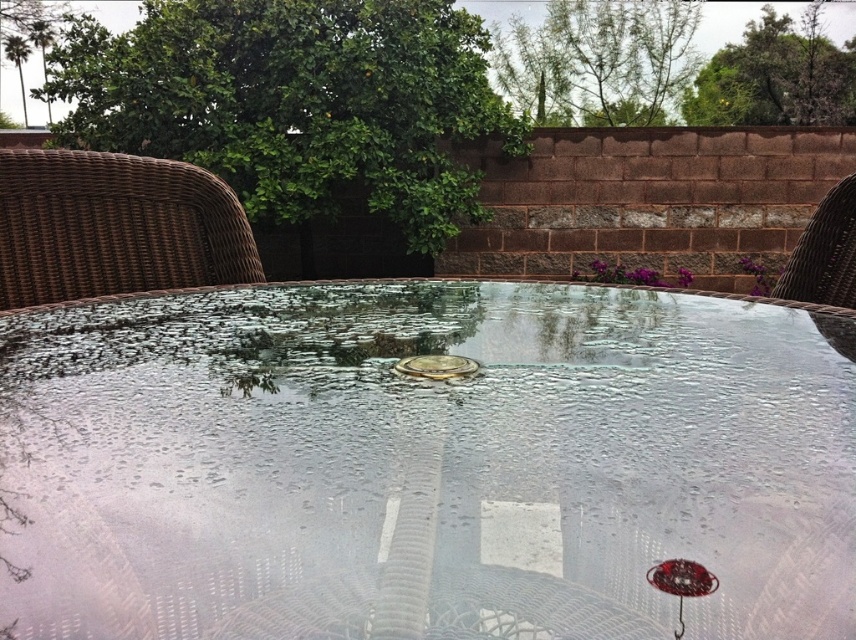
Is point (486, 566) farther from camera compared to point (434, 364)?

No, it is not.

Between transparent glass table at center and metallic gold coin at center, which one appears on the left side from the viewer's perspective?

From the viewer's perspective, transparent glass table at center appears more on the left side.

Is point (189, 333) positioned in front of point (455, 358)?

No, (189, 333) is behind (455, 358).

Identify the location of transparent glass table at center. This screenshot has width=856, height=640. [424, 465].

Who is shorter, transparent glass table at center or brown wicker chair at right?

With less height is transparent glass table at center.

Between transparent glass table at center and brown wicker chair at right, which one is positioned higher?

brown wicker chair at right is above.

Between point (227, 634) and point (813, 273), which one is positioned behind?

Positioned behind is point (813, 273).

Identify the location of transparent glass table at center. (424, 465).

From the picture: Which is below, brown wicker chair at left or metallic gold coin at center?

Positioned lower is metallic gold coin at center.

The height and width of the screenshot is (640, 856). Find the location of `brown wicker chair at left`. brown wicker chair at left is located at coordinates 114,227.

Between point (98, 214) and point (411, 369), which one is positioned behind?

Point (98, 214)

Locate an element on the screen. brown wicker chair at left is located at coordinates (114, 227).